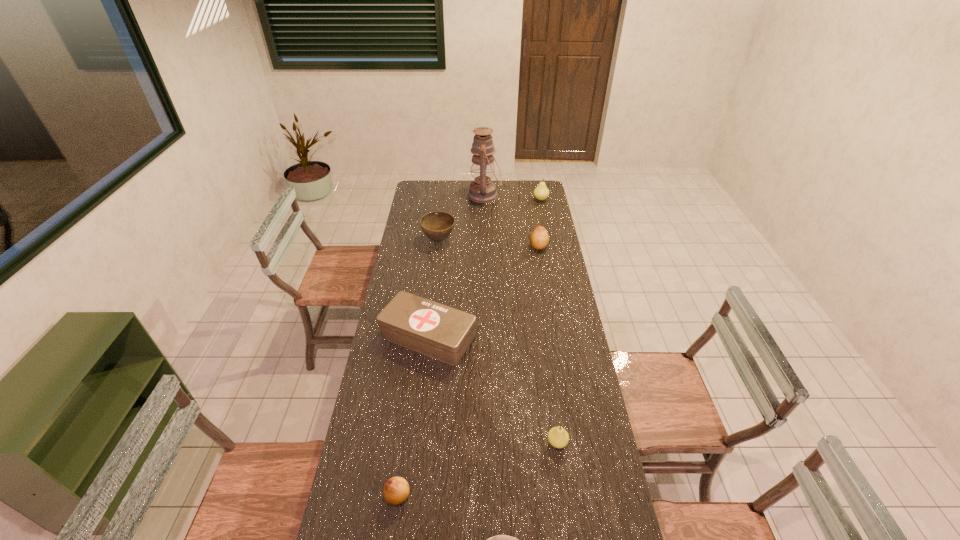
Find the location of a particular element. This screenshot has height=540, width=960. the sixth farthest object is located at coordinates (558, 437).

Where is `the smaller brown pear`? The image size is (960, 540). the smaller brown pear is located at coordinates (396, 490).

Find the location of a particular element. The width and height of the screenshot is (960, 540). the nearest pear is located at coordinates (396, 490).

The height and width of the screenshot is (540, 960). I want to click on vacant region located on the left of the blue oil lamp, so click(458, 195).

You are a GUI agent. You are given a task and a screenshot of the screen. Output one action in this format:
    pyautogui.click(x=<x>, y=<y>)
    Task: Click on the free space located on the front of the farthest pear
    Image resolution: width=960 pixels, height=540 pixels.
    Given the screenshot: What is the action you would take?
    pyautogui.click(x=545, y=220)

You are a GUI agent. You are given a task and a screenshot of the screen. Output one action in this format:
    pyautogui.click(x=<x>, y=<y>)
    Task: Click on the free space located on the left of the farther brown pear
    The height and width of the screenshot is (540, 960).
    Given the screenshot: What is the action you would take?
    pyautogui.click(x=515, y=246)

At what (x,y) coordinates should I click in order to perform the action: click on vacant space located 0.150m on the right of the brown bowl. Please return your answer as a coordinate pair (x, y). The height and width of the screenshot is (540, 960). Looking at the image, I should click on (486, 240).

At what (x,y) coordinates should I click in order to perform the action: click on free point located 0.150m on the right of the fifth farthest object. Please return your answer as a coordinate pair (x, y). The width and height of the screenshot is (960, 540). Looking at the image, I should click on (515, 336).

The image size is (960, 540). I want to click on free space located 0.400m on the back of the sixth farthest object, so click(542, 339).

Where is `vacant space located 0.240m on the back of the seventh farthest object`? vacant space located 0.240m on the back of the seventh farthest object is located at coordinates (409, 411).